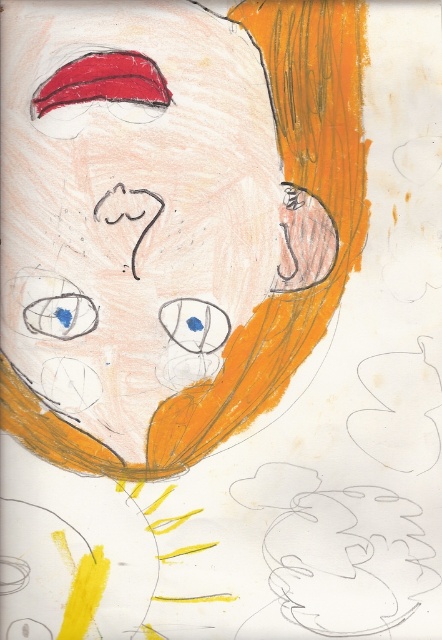
Question: Where is matte orange hair at upper right located in relation to blue matte eye at center in the image?

Choices:
 (A) right
 (B) left

Answer: (B)

Question: Is matte orange hair at upper right positioned at the back of blue matte eye at center?

Choices:
 (A) no
 (B) yes

Answer: (A)

Question: Estimate the real-world distances between objects in this image. Which object is farther from the matte orange hair at upper right?

Choices:
 (A) blue matte eye at upper left
 (B) blue matte eye at center

Answer: (A)

Question: Can you confirm if matte orange hair at upper right is wider than blue matte eye at center?

Choices:
 (A) no
 (B) yes

Answer: (B)

Question: Which object is farther from the camera taking this photo?

Choices:
 (A) blue matte eye at upper left
 (B) matte orange hair at upper right

Answer: (A)

Question: Which object is positioned farthest from the matte orange hair at upper right?

Choices:
 (A) blue matte eye at center
 (B) blue matte eye at upper left

Answer: (B)